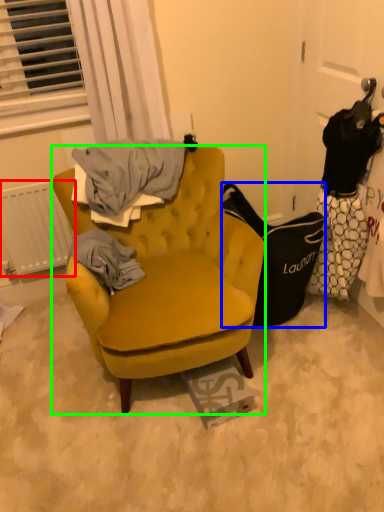
Question: Considering the real-world distances, which object is farthest from radiator (highlighted by a red box)? handbag (highlighted by a blue box) or chair (highlighted by a green box)?

Choices:
 (A) handbag
 (B) chair

Answer: (A)